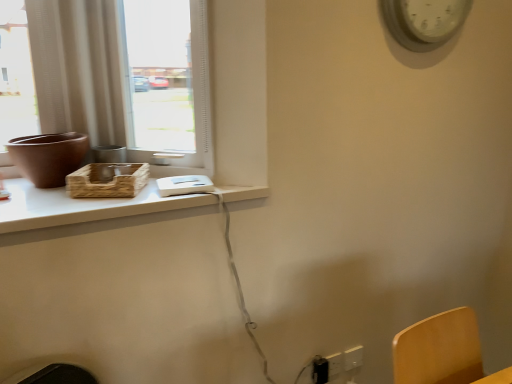
Question: Is point (112, 203) positioned closer to the camera than point (348, 354)?

Choices:
 (A) closer
 (B) farther

Answer: (A)

Question: Which is correct: white plastic tray at upper left is inside white plastic electric outlet at lower right, which ranks as the first electric outlet in right-to-left order, or outside of it?

Choices:
 (A) inside
 (B) outside

Answer: (B)

Question: Based on their relative distances, which object is farther from the white plastic electric outlet at lower right, arranged as the third electric outlet when viewed from the left?

Choices:
 (A) black plastic electric outlet at lower right, arranged as the first electric outlet when viewed from the left
 (B) matte brown vase at left
 (C) white plastic electric outlet at lower right, acting as the second electric outlet starting from the right
 (D) white plastic tray at upper left
 (E) woven brown basket at window

Answer: (B)

Question: Which of these objects is positioned closest to the white plastic tray at upper left?

Choices:
 (A) black plastic electric outlet at lower right, arranged as the first electric outlet when viewed from the left
 (B) white plastic electric outlet at lower right, arranged as the third electric outlet when viewed from the left
 (C) woven brown basket at window
 (D) matte glass window at upper left
 (E) white plastic clock at upper right

Answer: (C)